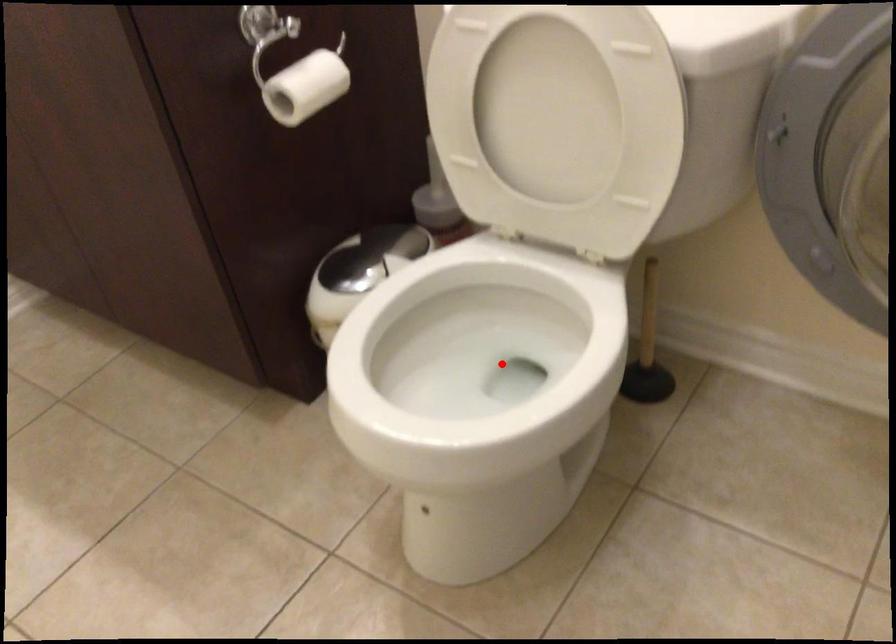
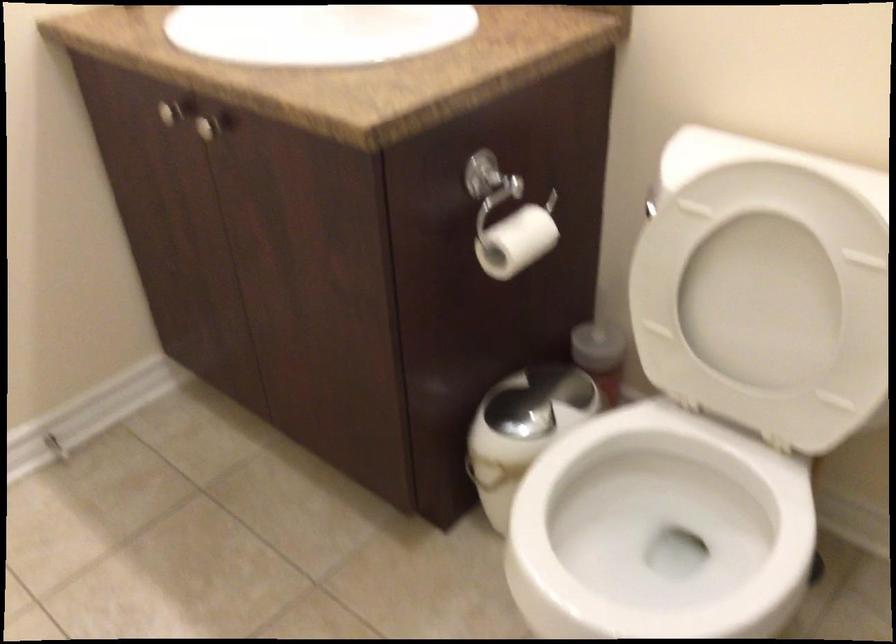
Find the pixel in the second image that matches the highlighted location in the first image.

(660, 524)